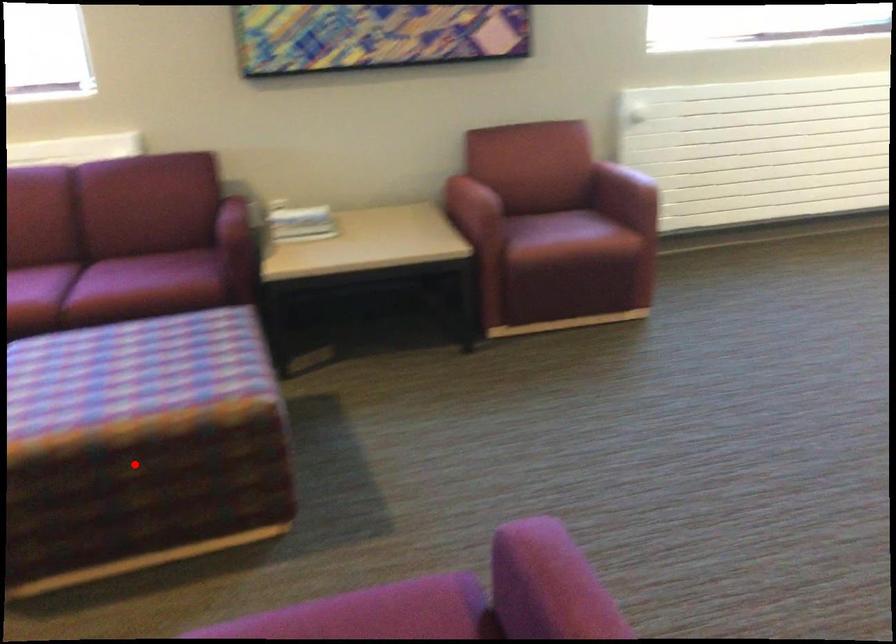
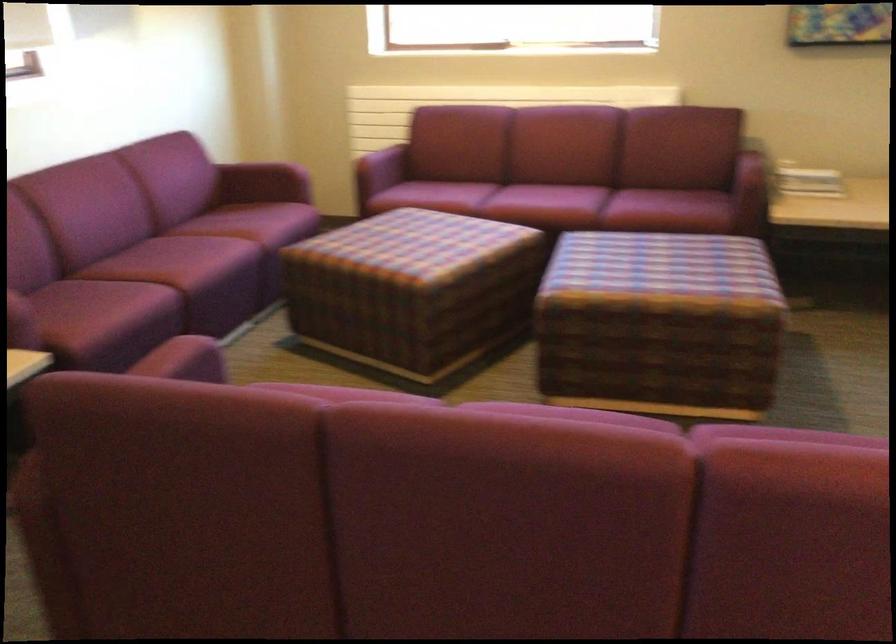
In the second image, find the point that corresponds to the highlighted location in the first image.

(659, 324)